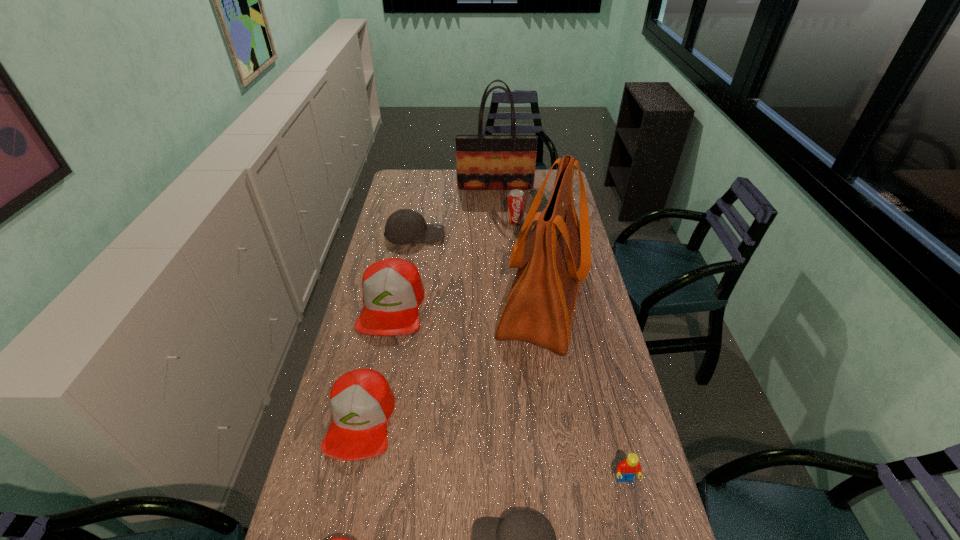
This screenshot has height=540, width=960. Find the location of `Lego that is at the right edge`. Lego that is at the right edge is located at coordinates (626, 470).

The height and width of the screenshot is (540, 960). What are the coordinates of `vacant space at the far edge of the desktop` in the screenshot? It's located at (435, 193).

Locate an element on the screen. The image size is (960, 540). free space at the right edge is located at coordinates (626, 457).

Identify the location of free spot at the far left corner of the desktop. (417, 171).

Identify the location of empty location between the red Lego and the nearer shopping bag. This screenshot has height=540, width=960. [x=584, y=389].

Identify the location of free space between the red Lego and the nearer shopping bag. This screenshot has width=960, height=540. (584, 389).

In order to click on free space between the second biggest red baseball cap and the Lego in this screenshot , I will do `click(492, 449)`.

Image resolution: width=960 pixels, height=540 pixels. What are the coordinates of `vacant space in between the left gray baseball cap and the red soda can` in the screenshot? It's located at (465, 227).

Where is `free space that is in between the farther shopping bag and the second biggest red baseball cap`? free space that is in between the farther shopping bag and the second biggest red baseball cap is located at coordinates [428, 303].

Where is `object identified as the second closest to the left gray baseball cap`? This screenshot has height=540, width=960. object identified as the second closest to the left gray baseball cap is located at coordinates (556, 257).